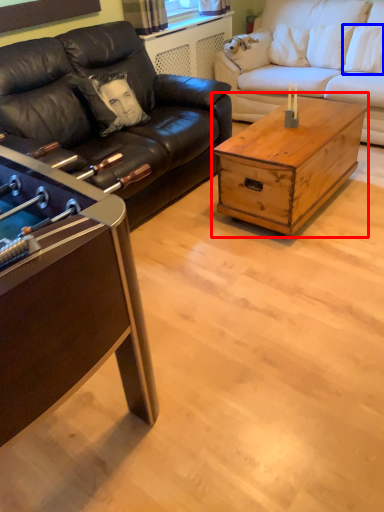
Question: Among these objects, which one is farthest to the camera, coffee table (highlighted by a red box) or pillow (highlighted by a blue box)?

Choices:
 (A) coffee table
 (B) pillow

Answer: (B)